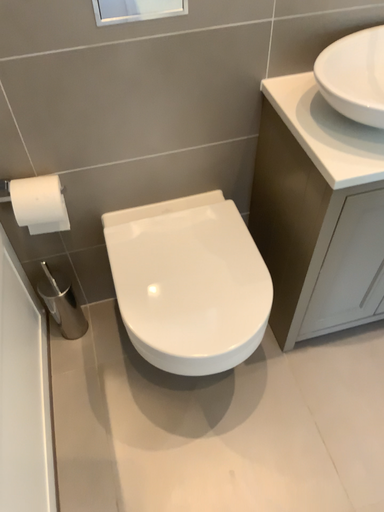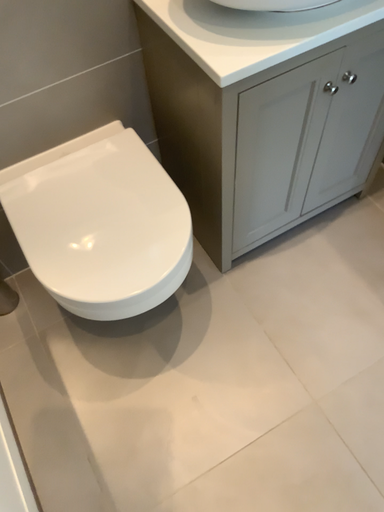
Question: Which way did the camera rotate in the video?

Choices:
 (A) rotated right
 (B) rotated left

Answer: (A)